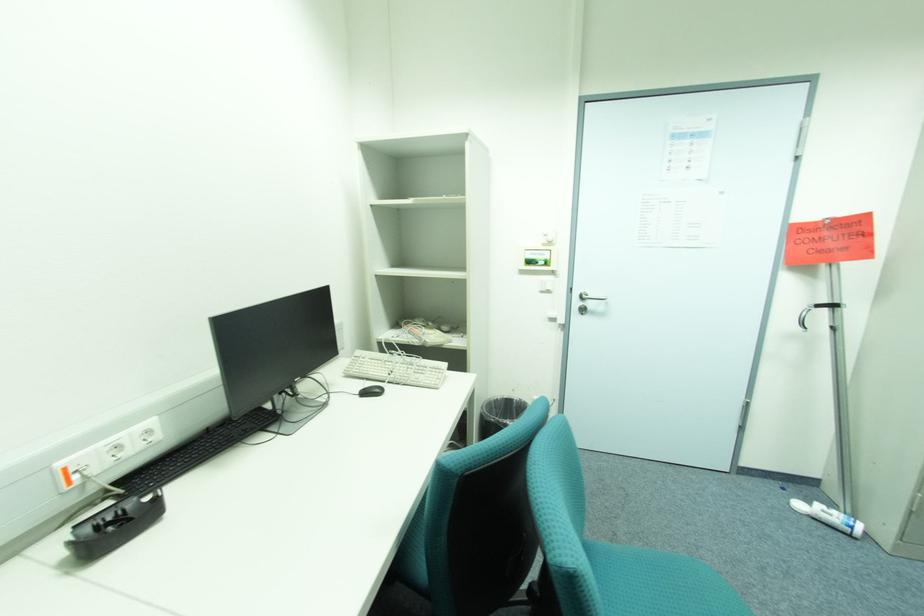
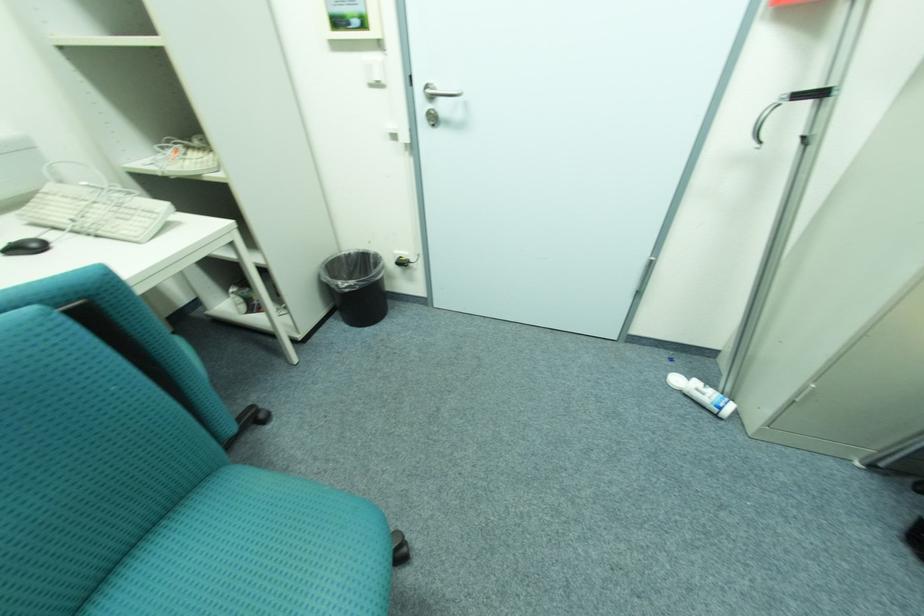
Where in the second image is the point corresponding to point (807, 506) from the first image?

(683, 381)